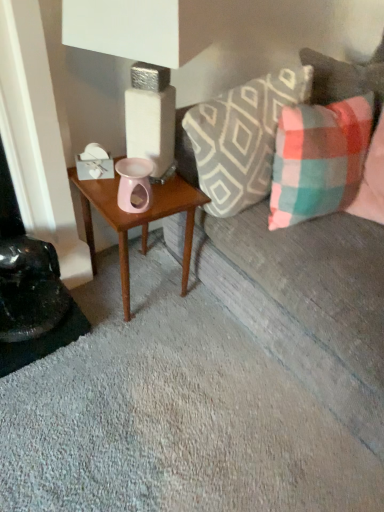
Question: From the image's perspective, is wooden table at center on plaid fabric pillow at right, which is the second pillow from left to right?

Choices:
 (A) yes
 (B) no

Answer: (B)

Question: From a real-world perspective, is wooden table at center under plaid fabric pillow at right, which is the second pillow from left to right?

Choices:
 (A) no
 (B) yes

Answer: (B)

Question: From the image's perspective, is wooden table at center below plaid fabric pillow at right, which is the second pillow from left to right?

Choices:
 (A) no
 (B) yes

Answer: (B)

Question: Does wooden table at center have a greater width compared to plaid fabric pillow at right, which is the second pillow from left to right?

Choices:
 (A) no
 (B) yes

Answer: (A)

Question: Can you confirm if wooden table at center is positioned to the right of plaid fabric pillow at right, the 1th pillow viewed from the right?

Choices:
 (A) no
 (B) yes

Answer: (A)

Question: Considering the relative sizes of wooden table at center and plaid fabric pillow at right, which is the second pillow from left to right, in the image provided, is wooden table at center taller than plaid fabric pillow at right, which is the second pillow from left to right,?

Choices:
 (A) no
 (B) yes

Answer: (B)

Question: From the image's perspective, would you say plaid fabric couch at upper right is positioned over wooden table at center?

Choices:
 (A) no
 (B) yes

Answer: (B)

Question: Is wooden table at center located within plaid fabric couch at upper right?

Choices:
 (A) no
 (B) yes

Answer: (A)

Question: Is plaid fabric couch at upper right positioned with its back to wooden table at center?

Choices:
 (A) no
 (B) yes

Answer: (A)

Question: Considering the relative sizes of plaid fabric couch at upper right and wooden table at center in the image provided, is plaid fabric couch at upper right taller than wooden table at center?

Choices:
 (A) no
 (B) yes

Answer: (B)

Question: Does plaid fabric couch at upper right have a lesser height compared to wooden table at center?

Choices:
 (A) yes
 (B) no

Answer: (B)

Question: Does plaid fabric couch at upper right have a lesser width compared to wooden table at center?

Choices:
 (A) no
 (B) yes

Answer: (A)

Question: Can you confirm if plaid fabric couch at upper right is positioned to the right of plaid fabric pillow at right, the 1th pillow viewed from the right?

Choices:
 (A) no
 (B) yes

Answer: (B)